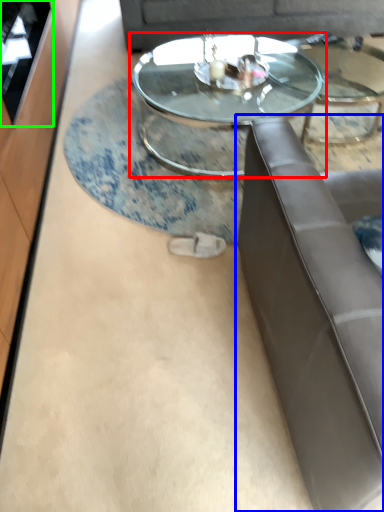
Question: Considering the real-world distances, which object is farthest from coffee table (highlighted by a red box)? studio couch (highlighted by a blue box) or glass door (highlighted by a green box)?

Choices:
 (A) studio couch
 (B) glass door

Answer: (A)